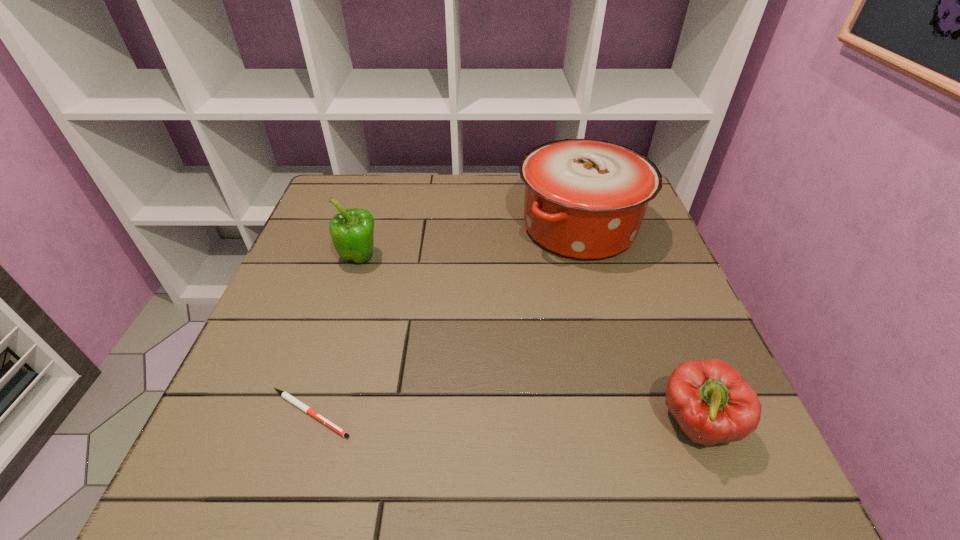
In order to click on casserole in this screenshot , I will do `click(585, 199)`.

Find the location of a particular element. The image size is (960, 540). the taller bell pepper is located at coordinates (351, 230).

This screenshot has height=540, width=960. I want to click on the farther bell pepper, so click(351, 230).

At what (x,y) coordinates should I click in order to perform the action: click on the second shortest object. Please return your answer as a coordinate pair (x, y). This screenshot has height=540, width=960. Looking at the image, I should click on (709, 399).

I want to click on the right bell pepper, so click(x=709, y=399).

This screenshot has width=960, height=540. Identify the location of the shortest object. (285, 395).

Locate an element on the screen. This screenshot has width=960, height=540. vacant space situated on the front of the tallest object is located at coordinates (629, 410).

Identify the location of vacant area situated 0.140m on the front of the farther bell pepper. The height and width of the screenshot is (540, 960). (341, 318).

This screenshot has height=540, width=960. In order to click on blank space located on the back of the second shortest object in this screenshot , I will do `click(660, 327)`.

Locate an element on the screen. This screenshot has width=960, height=540. vacant point located on the clicker of the pen is located at coordinates pyautogui.click(x=478, y=413).